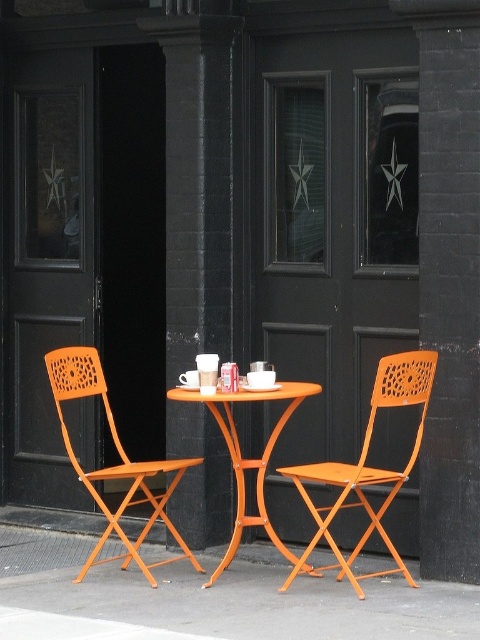
You are a delivery person trying to place a large pizza box that is 36 inches long on the table between the orange metal chair at center and the orange plastic chair at left. Can the pizza box fit between them without overlapping the chairs?

The orange metal chair at center and orange plastic chair at left are 36.14 inches apart from each other. Since the pizza box is 36 inches long, it can fit between them as the distance between the chairs is slightly larger than the pizza box.

You are standing at the entrance of the outdoor seating area and see two points marked on the ground. The first point is at coordinate point(365, 628) and the second is at point(181, 545). If you want to walk towards the point that is closer to the black brick wall with doors, which coordinate should you head towards?

Point(181, 545) is closer to the black brick wall with doors because it is behind point(365, 628).

You are a delivery person carrying a box that is 10 cm tall. You need to place it on the orange wood pavement at lower center or the orange metal chair at center. Which surface can it fit on without exceeding its height?

The orange wood pavement at lower center has a lesser height compared to orange metal chair at center, so the box can be placed on the orange wood pavement at lower center as it has lower height.